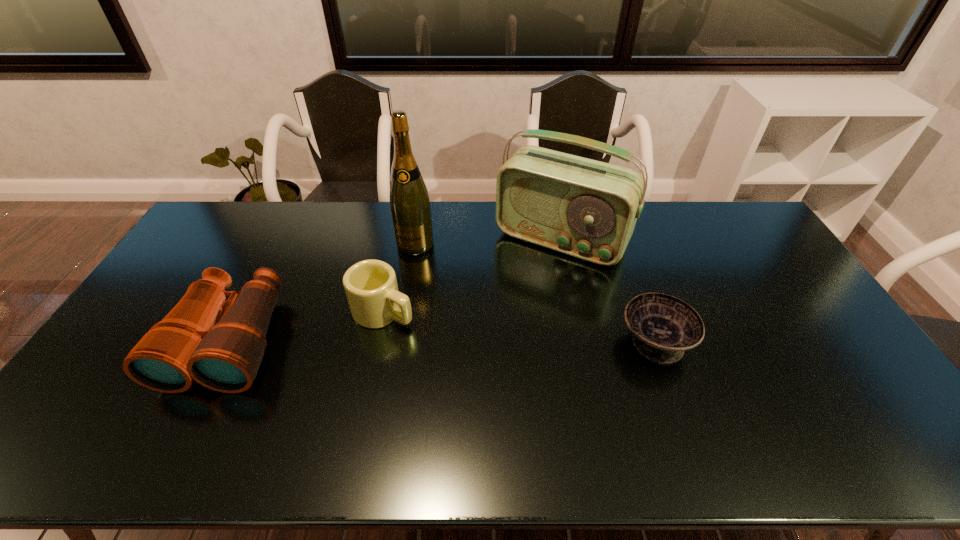
Identify the location of free spot at the left edge of the desktop. The width and height of the screenshot is (960, 540). (222, 258).

In the image, there is a desktop. Identify the location of free space at the near left corner. (108, 400).

Image resolution: width=960 pixels, height=540 pixels. In the image, there is a desktop. What are the coordinates of `free space at the far right corner` in the screenshot? It's located at (718, 210).

The image size is (960, 540). Identify the location of free space between the leftmost object and the mug. (307, 326).

This screenshot has height=540, width=960. In order to click on free space between the fourth shortest object and the shortest object in this screenshot , I will do `click(608, 291)`.

Identify the location of unoccupied position between the mug and the bowl. The height and width of the screenshot is (540, 960). (519, 327).

Where is `empty location between the shortest object and the mug`? The image size is (960, 540). empty location between the shortest object and the mug is located at coordinates (519, 327).

Where is `empty space between the leftmost object and the wine bottle`? empty space between the leftmost object and the wine bottle is located at coordinates (323, 292).

The height and width of the screenshot is (540, 960). Identify the location of unoccupied area between the bowl and the mug. (519, 327).

Where is `free spot between the mug and the radio receiver`? This screenshot has width=960, height=540. free spot between the mug and the radio receiver is located at coordinates (472, 275).